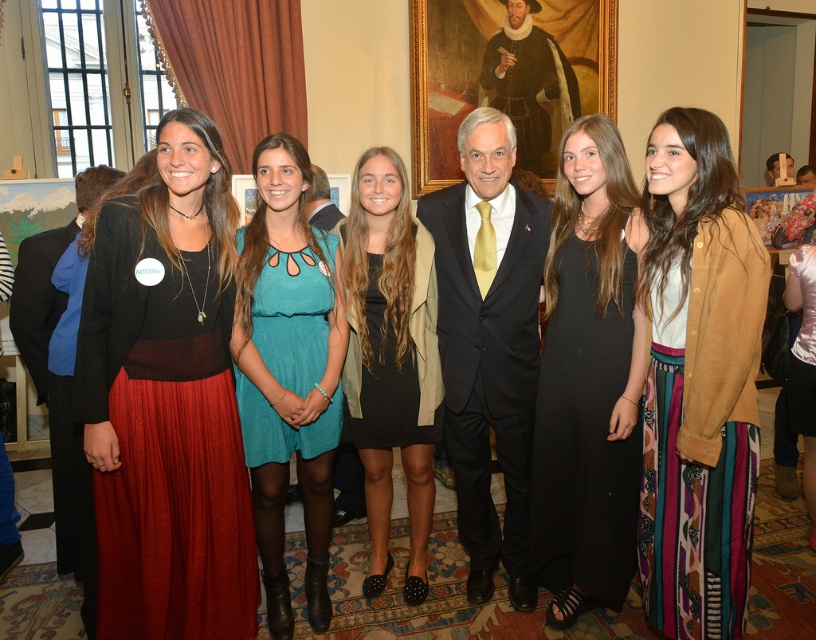
Which is more to the right, black satin dress at center or black matte dress at center?

Positioned to the right is black satin dress at center.

Who is shorter, black satin dress at center or black matte dress at center?

black matte dress at center

What do you see at coordinates (588, 380) in the screenshot? I see `black satin dress at center` at bounding box center [588, 380].

Where is `black satin dress at center`? black satin dress at center is located at coordinates (588, 380).

Locate an element on the screen. This screenshot has height=640, width=816. matte black top at center is located at coordinates (167, 401).

Does point (220, 529) come behind point (433, 413)?

No.

At what (x,y) coordinates should I click in order to perform the action: click on matte black top at center. Please return your answer as a coordinate pair (x, y). The image size is (816, 640). Looking at the image, I should click on (167, 401).

Locate an element on the screen. matte black top at center is located at coordinates (167, 401).

Which is below, matte black top at center or teal fabric dress at center?

teal fabric dress at center is lower down.

What do you see at coordinates (167, 401) in the screenshot? The image size is (816, 640). I see `matte black top at center` at bounding box center [167, 401].

You are a GUI agent. You are given a task and a screenshot of the screen. Output one action in this format:
    pyautogui.click(x=<x>, y=<y>)
    Task: Click on the matte black top at center
    The image size is (816, 640).
    Given the screenshot: What is the action you would take?
    pyautogui.click(x=167, y=401)